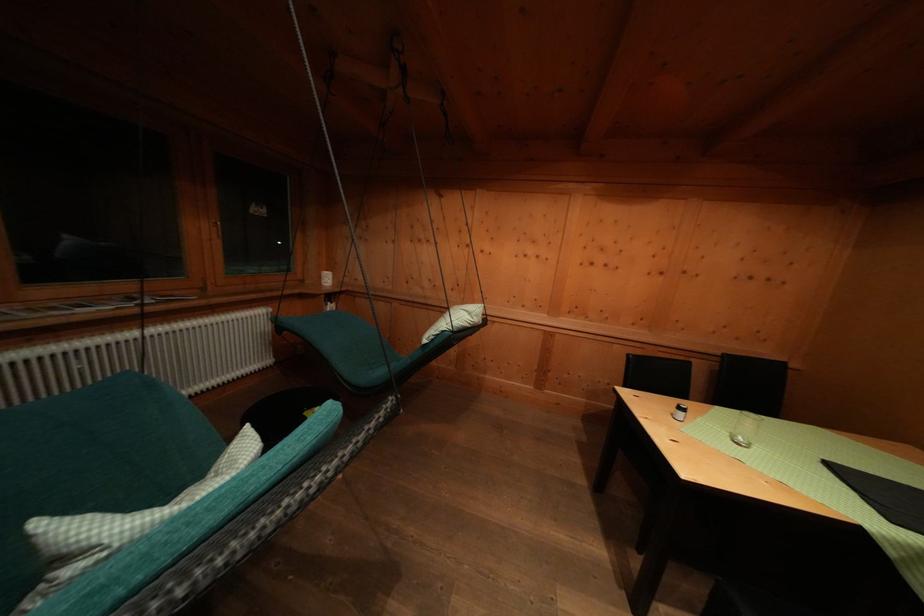
Which object does [745,429] point to?

It refers to a glass cup.